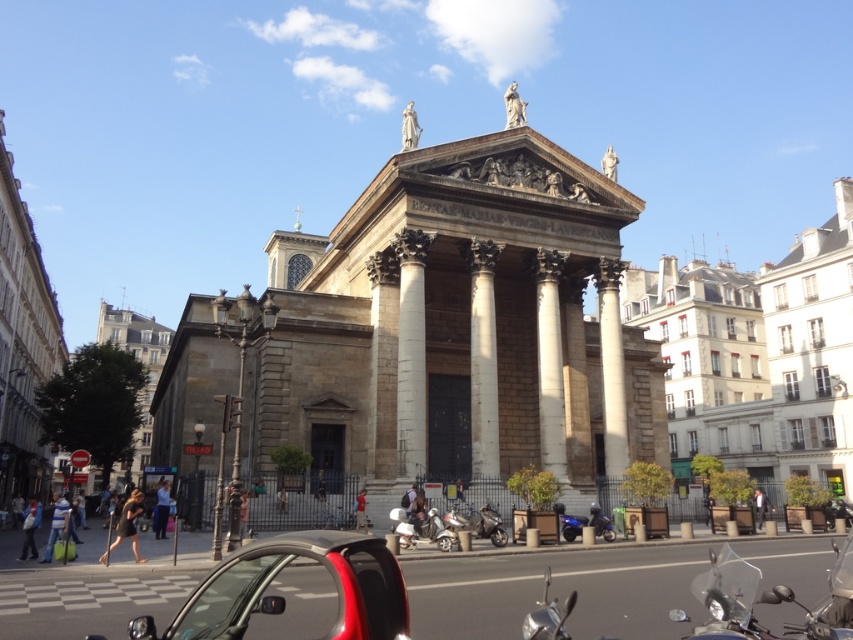
You are standing at the entrance of the grand neoclassical building and see the point marked at coordinates (758, 602). What object is located at this point?

The point at coordinates (758, 602) corresponds to a shiny chrome motorcycle at lower right.

You are a pedestrian standing at the entrance of the building. You see two shiny chrome motorcycles parked in the plaza. Which motorcycle is closer to you, the shiny chrome motorcycle at lower right or the shiny chrome motorcycle at lower center?

The shiny chrome motorcycle at lower right is closer to you because it is in front of the shiny chrome motorcycle at lower center.

You are a delivery person needing to park your motorcycle between the shiny chrome motorcycle at lower right and the shiny chrome motorcycle at lower center. The plaza has a no parking zone that extends 10 meters from the building. Can you safely park your motorcycle between them without violating the parking rules?

The distance between the shiny chrome motorcycle at lower right and the shiny chrome motorcycle at lower center is 21.84 meters. Since the no parking zone only extends 10 meters from the building, there is sufficient space between them to park your motorcycle without violating the parking rules.